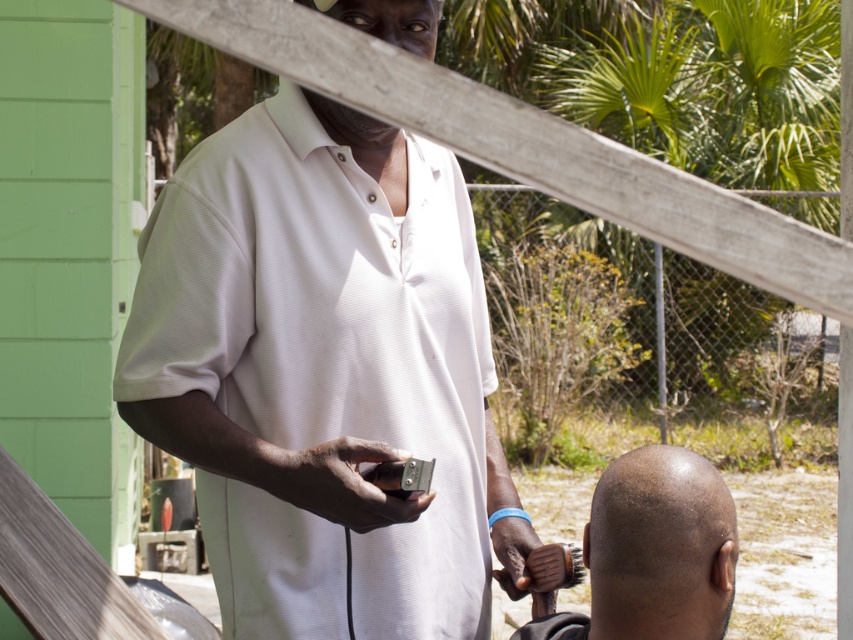
Question: Where is white matte shirt at center located in relation to bald head at center in the image?

Choices:
 (A) right
 (B) left

Answer: (B)

Question: From the image, what is the correct spatial relationship of white matte shirt at center in relation to bald head at center?

Choices:
 (A) left
 (B) right

Answer: (A)

Question: Which object is closer to the camera taking this photo?

Choices:
 (A) bald head at center
 (B) white matte shirt at center

Answer: (A)

Question: Does white matte shirt at center lie in front of bald head at center?

Choices:
 (A) no
 (B) yes

Answer: (A)